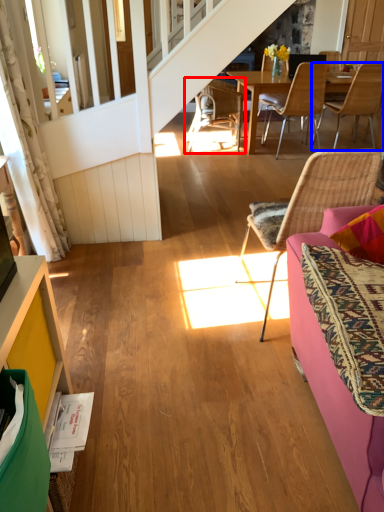
Question: Among these objects, which one is farthest to the camera, chair (highlighted by a red box) or chair (highlighted by a blue box)?

Choices:
 (A) chair
 (B) chair

Answer: (A)